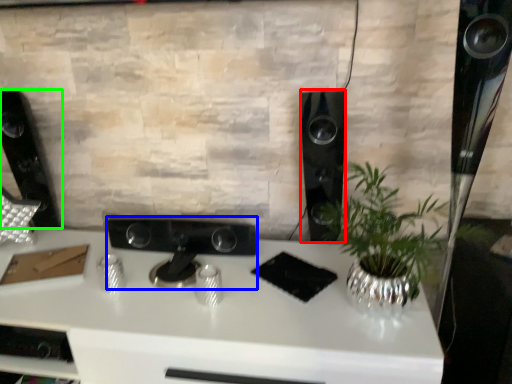
Question: Which object is positioned farthest from speaker (highlighted by a red box)? Select from appliance (highlighted by a blue box) and speaker (highlighted by a green box).

Choices:
 (A) appliance
 (B) speaker

Answer: (B)